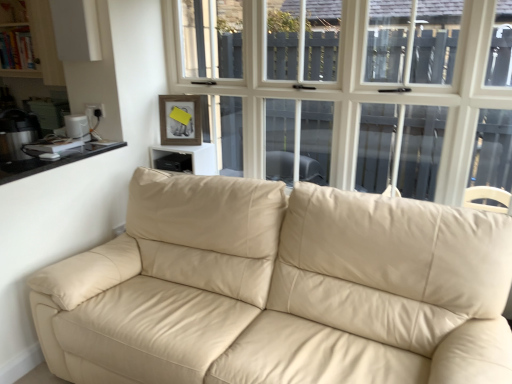
Question: Does metallic silver kettle at left, arranged as the 1th appliance when viewed from the left, have a lesser height compared to black glass counter top at left?

Choices:
 (A) yes
 (B) no

Answer: (B)

Question: Can you confirm if metallic silver kettle at left, the second appliance when ordered from right to left, is smaller than black glass counter top at left?

Choices:
 (A) yes
 (B) no

Answer: (B)

Question: From the image's perspective, does metallic silver kettle at left, the second appliance when ordered from right to left, appear lower than black glass counter top at left?

Choices:
 (A) no
 (B) yes

Answer: (A)

Question: Could you tell me if metallic silver kettle at left, the second appliance when ordered from right to left, is turned towards black glass counter top at left?

Choices:
 (A) no
 (B) yes

Answer: (A)

Question: Is metallic silver kettle at left, the second appliance when ordered from right to left, behind black glass counter top at left?

Choices:
 (A) yes
 (B) no

Answer: (A)

Question: From a real-world perspective, is white plastic toaster at left, which is the 1th appliance in right-to-left order, positioned above or below black plastic speaker at upper center?

Choices:
 (A) below
 (B) above

Answer: (B)

Question: Considering the positions of white plastic toaster at left, which is the 1th appliance in right-to-left order, and black plastic speaker at upper center in the image, is white plastic toaster at left, which is the 1th appliance in right-to-left order, wider or thinner than black plastic speaker at upper center?

Choices:
 (A) thin
 (B) wide

Answer: (A)

Question: Is white plastic toaster at left, which is the 1th appliance in right-to-left order, to the left or to the right of black plastic speaker at upper center in the image?

Choices:
 (A) right
 (B) left

Answer: (B)

Question: Do you think white plastic toaster at left, which is the 1th appliance in right-to-left order, is within black plastic speaker at upper center, or outside of it?

Choices:
 (A) inside
 (B) outside

Answer: (B)

Question: In terms of height, does beige leather couch at center look taller or shorter compared to white plastic toaster at left, which is the 1th appliance in right-to-left order?

Choices:
 (A) short
 (B) tall

Answer: (B)

Question: From a real-world perspective, relative to white plastic toaster at left, the second appliance when ordered from left to right, is beige leather couch at center vertically above or below?

Choices:
 (A) above
 (B) below

Answer: (B)

Question: Considering the positions of beige leather couch at center and white plastic toaster at left, the second appliance when ordered from left to right, in the image, is beige leather couch at center wider or thinner than white plastic toaster at left, the second appliance when ordered from left to right,?

Choices:
 (A) wide
 (B) thin

Answer: (A)

Question: Looking at the image, does beige leather couch at center seem bigger or smaller compared to white plastic toaster at left, which is the 1th appliance in right-to-left order?

Choices:
 (A) small
 (B) big

Answer: (B)

Question: Is point (369, 251) closer or farther from the camera than point (34, 160)?

Choices:
 (A) closer
 (B) farther

Answer: (A)

Question: From a real-world perspective, is beige leather couch at center physically located above or below black glass counter top at left?

Choices:
 (A) below
 (B) above

Answer: (A)